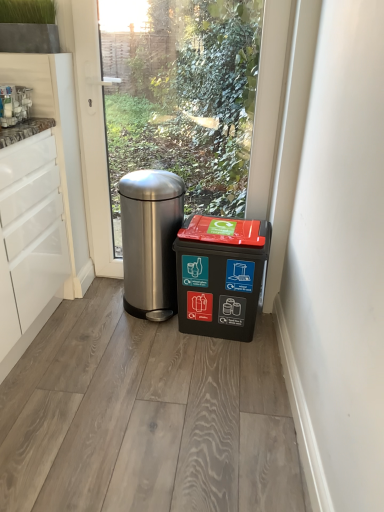
Question: From a real-world perspective, is polished stainless steel trash can at center, positioned as the first waste container in left-to-right order, positioned above or below black plastic recycling bin at lower right, acting as the first waste container starting from the right?

Choices:
 (A) above
 (B) below

Answer: (A)

Question: Would you say polished stainless steel trash can at center, positioned as the first waste container in left-to-right order, is inside or outside black plastic recycling bin at lower right, which appears as the second waste container when viewed from the left?

Choices:
 (A) outside
 (B) inside

Answer: (A)

Question: Considering the relative positions of polished stainless steel trash can at center, positioned as the first waste container in left-to-right order, and black plastic recycling bin at lower right, which appears as the second waste container when viewed from the left, in the image provided, is polished stainless steel trash can at center, positioned as the first waste container in left-to-right order, to the left or to the right of black plastic recycling bin at lower right, which appears as the second waste container when viewed from the left,?

Choices:
 (A) right
 (B) left

Answer: (B)

Question: From the image's perspective, is black plastic recycling bin at lower right, which appears as the second waste container when viewed from the left, positioned above or below polished stainless steel trash can at center, the 2th waste container in the right-to-left sequence?

Choices:
 (A) above
 (B) below

Answer: (B)

Question: Considering the positions of black plastic recycling bin at lower right, which appears as the second waste container when viewed from the left, and polished stainless steel trash can at center, positioned as the first waste container in left-to-right order, in the image, is black plastic recycling bin at lower right, which appears as the second waste container when viewed from the left, wider or thinner than polished stainless steel trash can at center, positioned as the first waste container in left-to-right order,?

Choices:
 (A) wide
 (B) thin

Answer: (B)

Question: From a real-world perspective, relative to polished stainless steel trash can at center, positioned as the first waste container in left-to-right order, is black plastic recycling bin at lower right, which appears as the second waste container when viewed from the left, vertically above or below?

Choices:
 (A) below
 (B) above

Answer: (A)

Question: Which is correct: black plastic recycling bin at lower right, acting as the first waste container starting from the right, is inside polished stainless steel trash can at center, positioned as the first waste container in left-to-right order, or outside of it?

Choices:
 (A) inside
 (B) outside

Answer: (B)